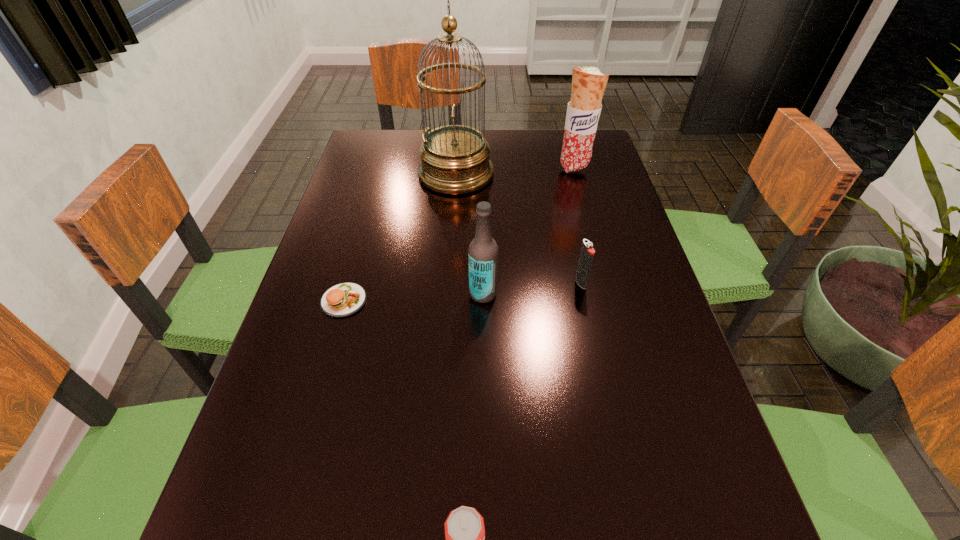
Locate an element on the screen. vacant area at the left edge is located at coordinates (286, 458).

The image size is (960, 540). In the image, there is a desktop. Identify the location of vacant space at the right edge. click(660, 397).

Locate an element on the screen. This screenshot has width=960, height=540. free space at the far left corner is located at coordinates (388, 141).

At what (x,y) coordinates should I click in order to perform the action: click on free space at the far right corner of the desktop. Please return your answer as a coordinate pair (x, y). Looking at the image, I should click on (552, 134).

You are a GUI agent. You are given a task and a screenshot of the screen. Output one action in this format:
    pyautogui.click(x=<x>, y=<y>)
    Task: Click on the vacant area that lies between the burrito and the igniter
    
    Given the screenshot: What is the action you would take?
    pyautogui.click(x=577, y=225)

Locate an element on the screen. The height and width of the screenshot is (540, 960). free space between the fourth shortest object and the tallest object is located at coordinates (469, 234).

Find the location of a particular element. The height and width of the screenshot is (540, 960). empty space that is in between the fifth shortest object and the beer bottle is located at coordinates (529, 231).

The height and width of the screenshot is (540, 960). Find the location of `vacant space that's between the leftmost object and the fourth tallest object`. vacant space that's between the leftmost object and the fourth tallest object is located at coordinates (463, 292).

At what (x,y) coordinates should I click in order to perform the action: click on vacant area that lies between the birdcage and the fourth tallest object. Please return your answer as a coordinate pair (x, y). Looking at the image, I should click on (518, 228).

Where is `empty space between the tallest object and the shortest object`? This screenshot has width=960, height=540. empty space between the tallest object and the shortest object is located at coordinates (400, 238).